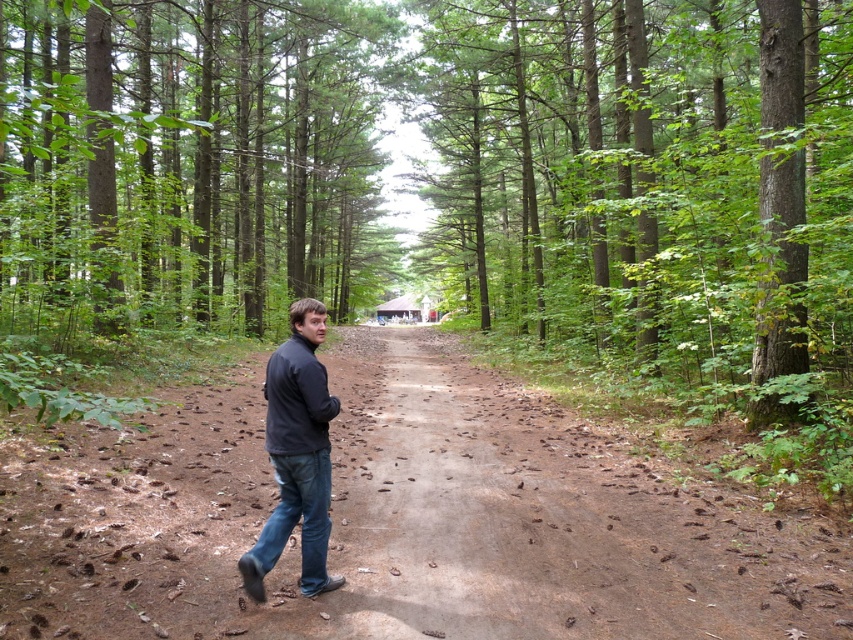
You are standing at the entrance of the forest and see the green rough bark tree at center. If you want to walk towards it along the dirt path, which direction should you head?

The green rough bark tree at center is located at point [653,182], which means it is positioned to the lower right of your current position. Therefore, you should head towards the lower right direction along the dirt path to reach it.

You are standing at the point marked by the coordinates point (653, 182) in the forest scene. What object is located exactly at that point?

The point (653, 182) indicates a green rough bark tree at center.